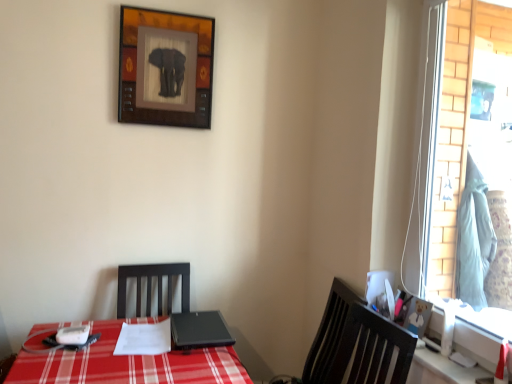
Question: Does glass window at right have a lesser width compared to light blue fabric at right?

Choices:
 (A) no
 (B) yes

Answer: (B)

Question: Is glass window at right at the left side of light blue fabric at right?

Choices:
 (A) yes
 (B) no

Answer: (A)

Question: Is the surface of glass window at right in direct contact with light blue fabric at right?

Choices:
 (A) no
 (B) yes

Answer: (A)

Question: From the image's perspective, does glass window at right appear higher than light blue fabric at right?

Choices:
 (A) no
 (B) yes

Answer: (B)

Question: Is glass window at right positioned in front of light blue fabric at right?

Choices:
 (A) no
 (B) yes

Answer: (B)

Question: Is light blue fabric at right wider or thinner than wooden framed elephant at upper center, placed as the 1th picture frame when sorted from left to right?

Choices:
 (A) thin
 (B) wide

Answer: (B)

Question: In terms of height, does light blue fabric at right look taller or shorter compared to wooden framed elephant at upper center, the second picture frame from the right?

Choices:
 (A) tall
 (B) short

Answer: (A)

Question: In the image, is light blue fabric at right positioned in front of or behind wooden framed elephant at upper center, which is counted as the 1th picture frame, starting from the back?

Choices:
 (A) front
 (B) behind

Answer: (B)

Question: Considering the positions of point (483, 178) and point (170, 100), is point (483, 178) closer or farther from the camera than point (170, 100)?

Choices:
 (A) closer
 (B) farther

Answer: (A)

Question: From a real-world perspective, is wooden bear picture frame at right, which appears as the 2th picture frame when viewed from the top, positioned above or below light blue fabric at right?

Choices:
 (A) above
 (B) below

Answer: (B)

Question: From the image's perspective, is wooden bear picture frame at right, the second picture frame from the left, positioned above or below light blue fabric at right?

Choices:
 (A) below
 (B) above

Answer: (A)

Question: Relative to light blue fabric at right, is wooden bear picture frame at right, the 1th picture frame viewed from the right, in front or behind?

Choices:
 (A) behind
 (B) front

Answer: (B)

Question: Visually, is wooden bear picture frame at right, which appears as the 2th picture frame when viewed from the top, positioned to the left or to the right of light blue fabric at right?

Choices:
 (A) left
 (B) right

Answer: (A)

Question: Considering the positions of point tap(408, 327) and point tap(188, 329), is point tap(408, 327) closer or farther from the camera than point tap(188, 329)?

Choices:
 (A) closer
 (B) farther

Answer: (A)

Question: In terms of width, does wooden bear picture frame at right, the first picture frame in the front-to-back sequence, look wider or thinner when compared to black matte laptop at center?

Choices:
 (A) wide
 (B) thin

Answer: (B)